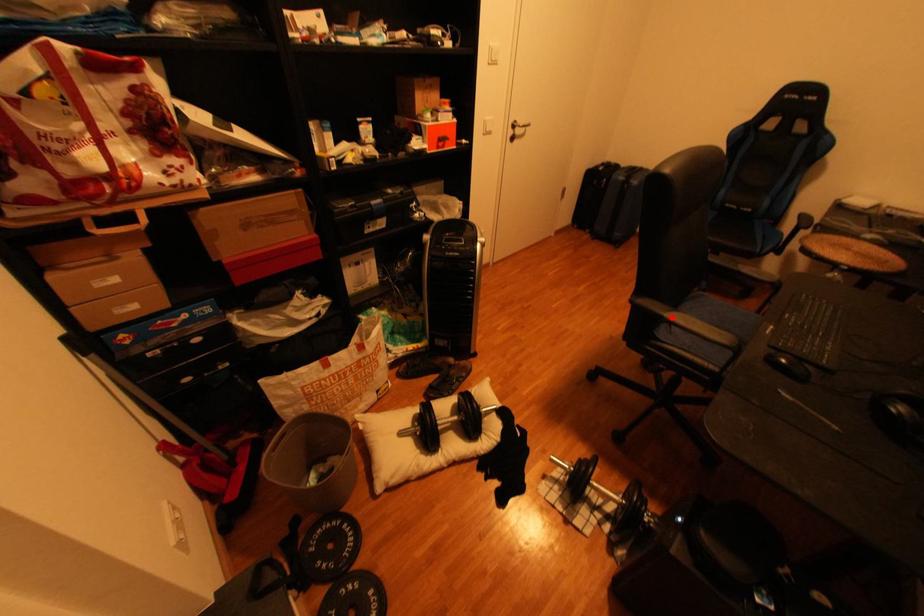
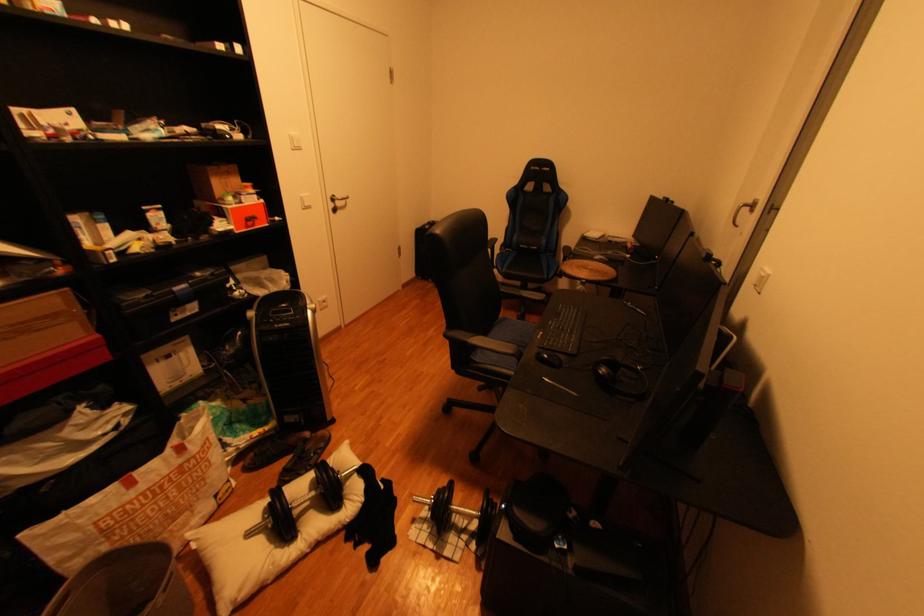
Where in the second image is the point corresponding to the highlighted location from the first image?

(477, 344)